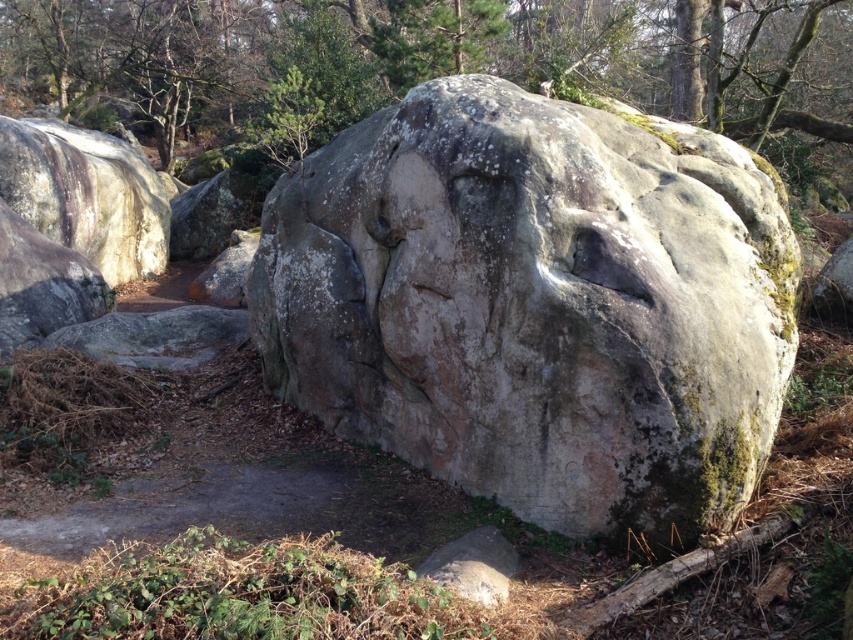
You are a hiker who wants to take a photo of both the gray stone face at center and the green mossy rock at upper center. Which object should you stand closer to in order to capture both in the same frame?

You should stand closer to the green mossy rock at upper center because the gray stone face at center is positioned on the right side of it, meaning the gray stone face at center is further away from the viewer. By moving closer to the green mossy rock at upper center, you can include both objects in your photo frame more effectively.

You are a geologist examining the gray stone face at center and the green mossy rock at upper center. Which of these two objects has a smaller width?

The gray stone face at center has a smaller width than the green mossy rock at upper center.